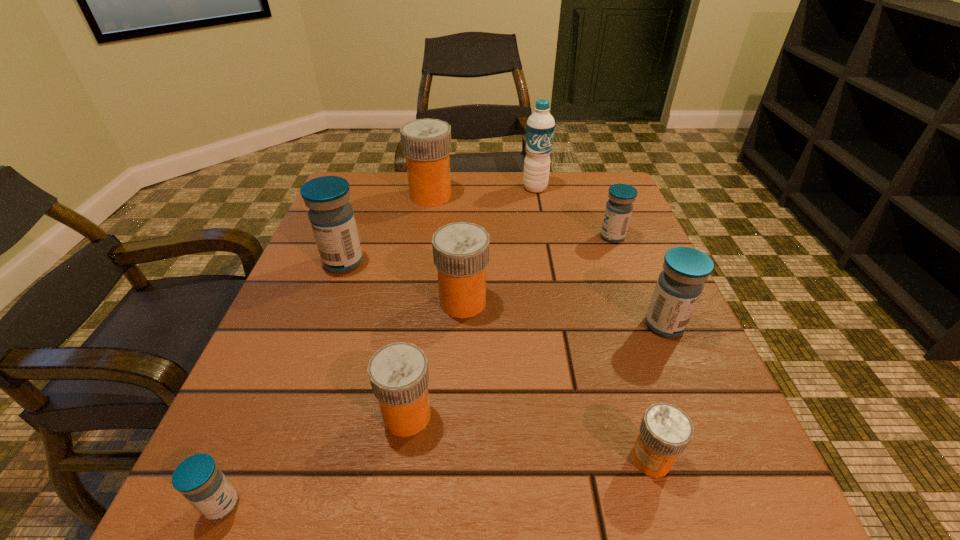
Where is `free region at the far edge`? free region at the far edge is located at coordinates (452, 181).

At what (x,y) coordinates should I click in order to perform the action: click on free location at the left edge. Please return your answer as a coordinate pair (x, y). Image resolution: width=960 pixels, height=540 pixels. Looking at the image, I should click on (349, 322).

Locate an element on the screen. The height and width of the screenshot is (540, 960). vacant area at the right edge is located at coordinates (576, 235).

The height and width of the screenshot is (540, 960). In order to click on vacant space at the far left corner of the desktop in this screenshot , I will do `click(361, 178)`.

Where is `free space at the far right corner of the desktop`? free space at the far right corner of the desktop is located at coordinates 621,184.

Find the location of a particular element. This screenshot has width=960, height=540. free space between the third nearest orange medicine and the third medicine from right to left is located at coordinates (x=557, y=380).

The width and height of the screenshot is (960, 540). I want to click on free spot between the farthest blue medicine and the third nearest orange medicine, so click(538, 269).

I want to click on free space between the third biggest orange medicine and the smallest blue medicine, so click(315, 460).

Where is `vacant space that's between the third biggest orange medicine and the nearest object`? Image resolution: width=960 pixels, height=540 pixels. vacant space that's between the third biggest orange medicine and the nearest object is located at coordinates 315,460.

Image resolution: width=960 pixels, height=540 pixels. I want to click on empty space between the farthest blue medicine and the smallest orange medicine, so click(x=632, y=348).